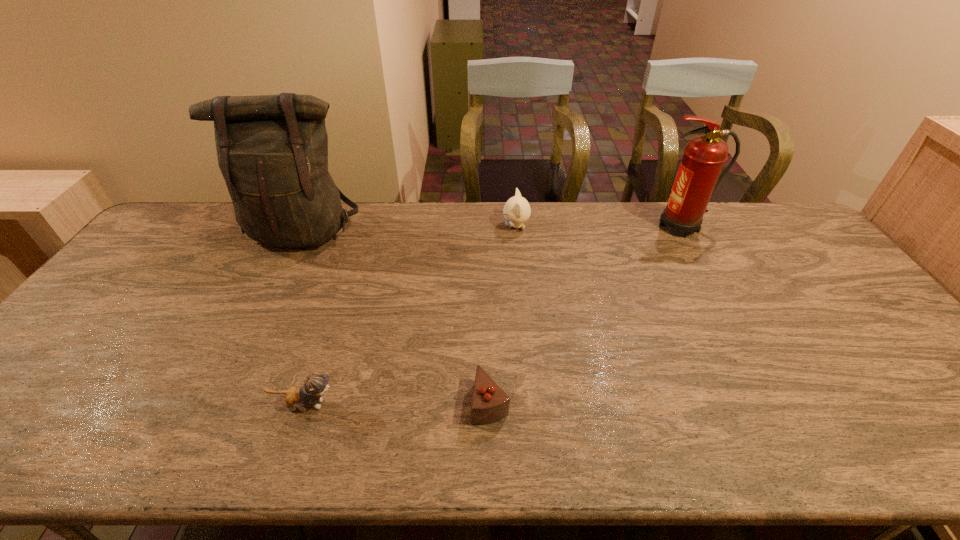
At what (x,y) coordinates should I click in order to perform the action: click on empty space that is in between the third object from left to right and the fire extinguisher. Please return your answer as a coordinate pair (x, y). Image resolution: width=960 pixels, height=540 pixels. Looking at the image, I should click on (586, 314).

At what (x,y) coordinates should I click in order to perform the action: click on vacant point located between the shorter kitten and the fourth shortest object. Please return your answer as a coordinate pair (x, y). This screenshot has height=540, width=960. Looking at the image, I should click on [x=493, y=315].

Identify the location of free space between the shortest object and the tallest object. (396, 318).

What are the coordinates of `free spot between the fourth shortest object and the second object from right to left` in the screenshot? It's located at (599, 226).

This screenshot has width=960, height=540. I want to click on empty space that is in between the shortest object and the fourth shortest object, so click(586, 314).

I want to click on vacant space that is in between the farther kitten and the fourth shortest object, so click(x=599, y=226).

I want to click on the third closest object to the backpack, so click(x=490, y=403).

The width and height of the screenshot is (960, 540). What are the coordinates of `the closest object to the shortest object` in the screenshot? It's located at (315, 385).

Locate an element on the screen. vacant position in the image that satisfies the following two spatial constraints: 1. on the open flap of the third object from left to right; 2. on the left side of the tallest object is located at coordinates (220, 402).

You are a GUI agent. You are given a task and a screenshot of the screen. Output one action in this format:
    pyautogui.click(x=<x>, y=<y>)
    Task: Click on the vacant area that satisfies the following two spatial constraints: 1. on the face of the farther kitten; 2. on the open flap of the backpack
    This screenshot has height=540, width=960.
    Given the screenshot: What is the action you would take?
    pyautogui.click(x=516, y=232)